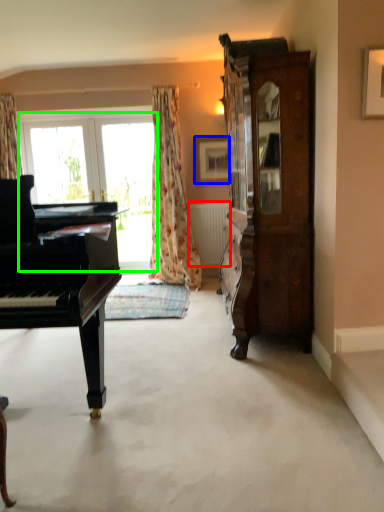
Question: Considering the real-world distances, which object is closest to radiator (highlighted by a red box)? picture frame (highlighted by a blue box) or bay window (highlighted by a green box).

Choices:
 (A) picture frame
 (B) bay window

Answer: (A)